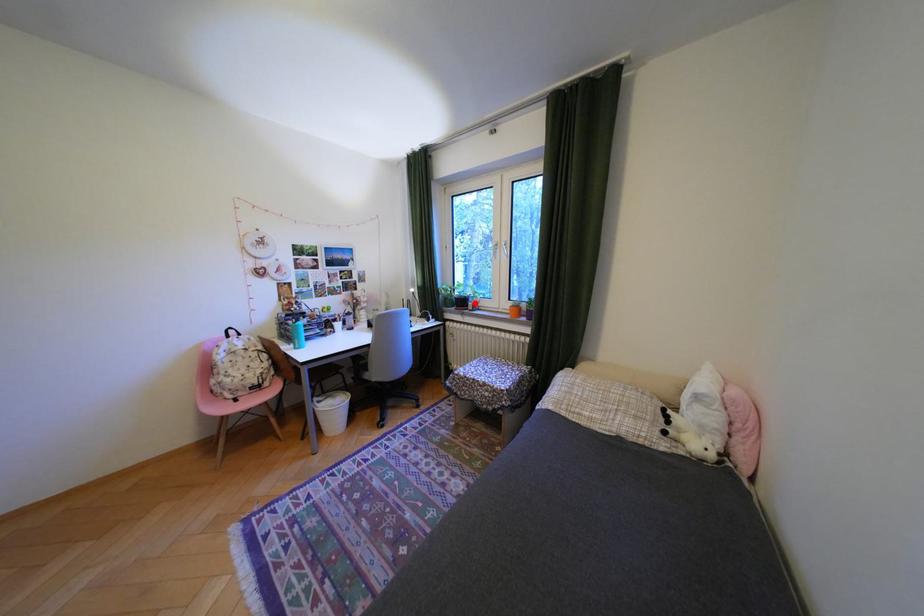
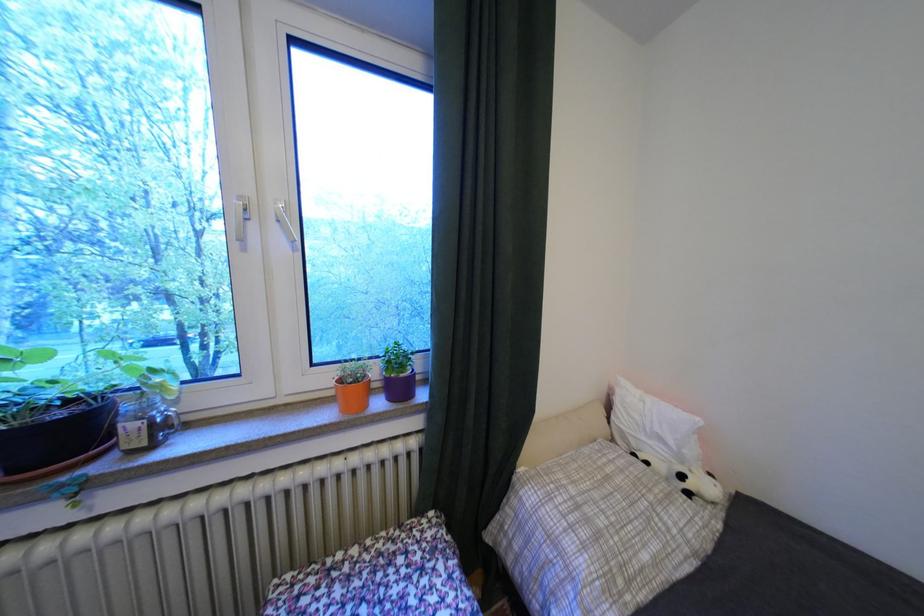
Where in the second image is the point corresponding to the highlighted location from the first image?

(75, 436)